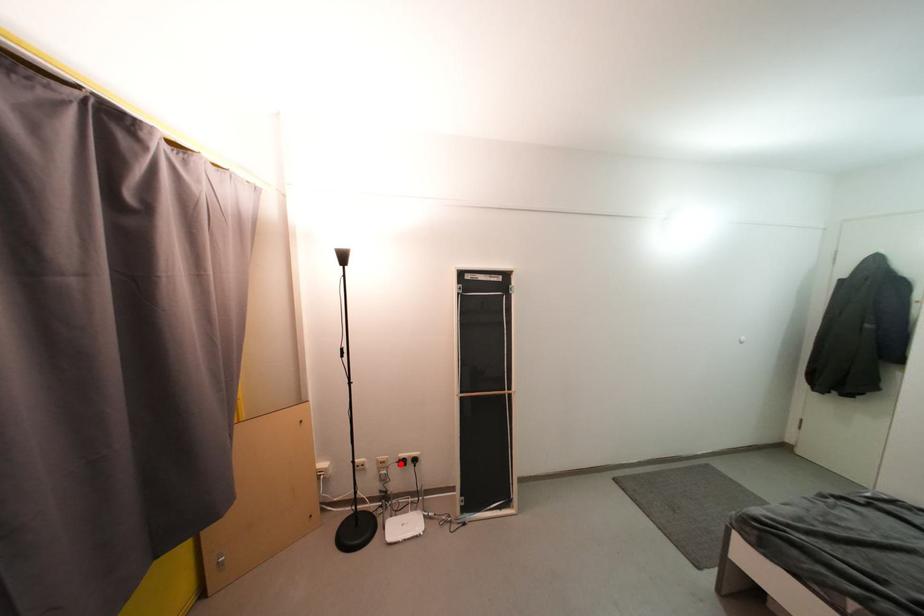
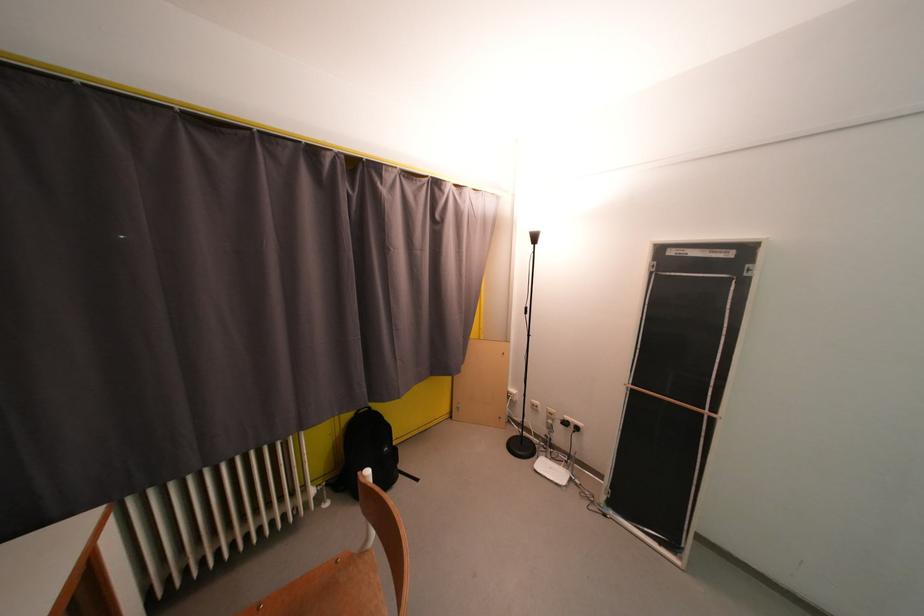
Locate, in the second image, the point that corresponds to the highlighted location in the first image.

(565, 421)